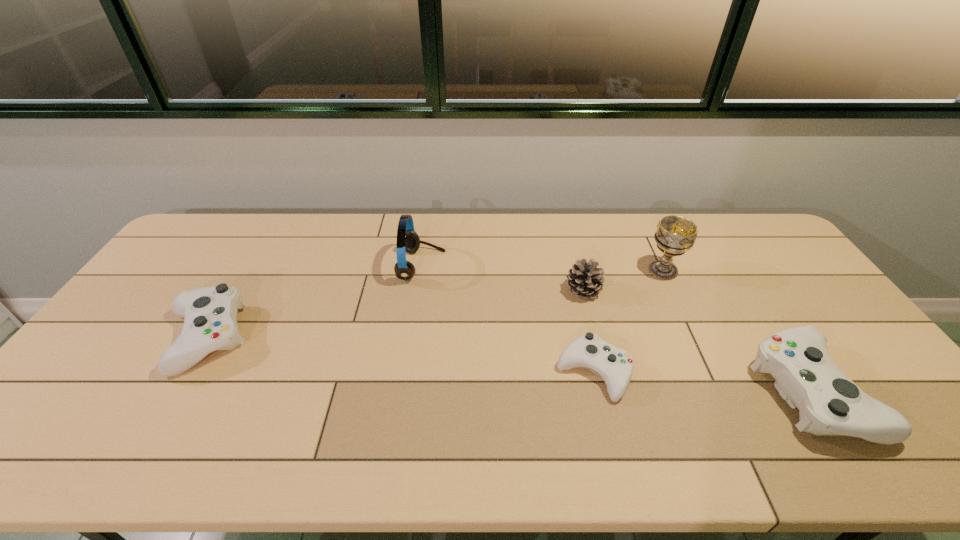
Locate an element on the screen. This screenshot has width=960, height=540. vacant space that satisfies the following two spatial constraints: 1. with the microphone attached to the side of the chalice; 2. on the left side of the second object from left to right is located at coordinates (421, 271).

Find the location of a particular element. free point that satisfies the following two spatial constraints: 1. on the back side of the fifth object from left to right; 2. with the microphone attached to the side of the headset is located at coordinates (660, 266).

The height and width of the screenshot is (540, 960). In order to click on vacant position in the image that satisfies the following two spatial constraints: 1. on the front side of the second shortest object; 2. on the left side of the rightmost control in this screenshot , I will do `click(174, 392)`.